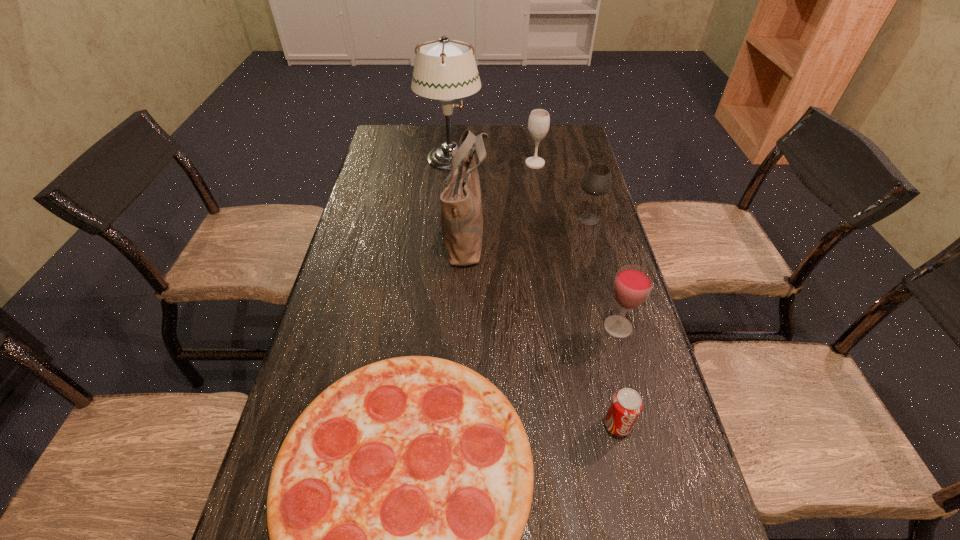
Identify the location of lampshade. This screenshot has height=540, width=960. (444, 69).

Locate an element on the screen. Image resolution: width=960 pixels, height=540 pixels. shoulder bag is located at coordinates (461, 207).

Find the location of a particular element. the fourth object from left to right is located at coordinates (539, 120).

I want to click on the leftmost wineglass, so click(x=539, y=120).

At what (x,y) coordinates should I click in order to perform the action: click on the second farthest wineglass. Please return your answer as a coordinate pair (x, y). The width and height of the screenshot is (960, 540). Looking at the image, I should click on (597, 180).

You are a GUI agent. You are given a task and a screenshot of the screen. Output one action in this format:
    pyautogui.click(x=<x>, y=<y>)
    Task: Click on the nearest wineglass
    
    Given the screenshot: What is the action you would take?
    (633, 284)

Identify the location of the sixth tallest object. Image resolution: width=960 pixels, height=540 pixels. (626, 405).

Image resolution: width=960 pixels, height=540 pixels. In order to click on vacant space located on the lampshade of the lampshade in this screenshot , I will do click(x=523, y=159).

Find the location of a particular element. The width and height of the screenshot is (960, 540). vacant space positioned 0.350m on the front-facing side of the shoulder bag is located at coordinates (607, 234).

Find the location of `free space located 0.060m on the back of the leftmost wineglass`. free space located 0.060m on the back of the leftmost wineglass is located at coordinates (533, 150).